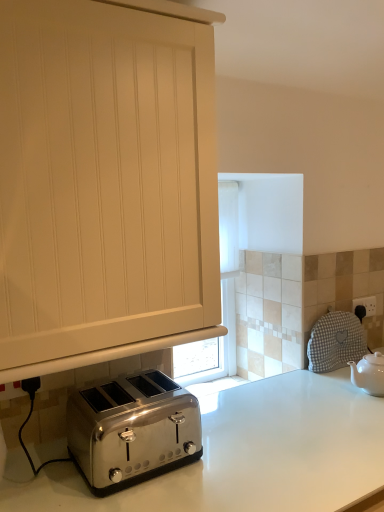
Locate an element on the screen. This screenshot has height=512, width=384. unoccupied region to the right of satin silver toaster at lower left is located at coordinates (229, 453).